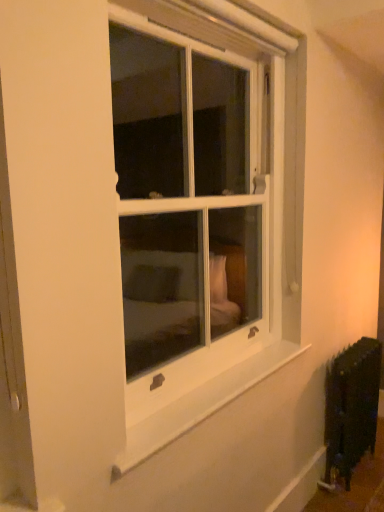
Where is `vacant area on top of white smooth window sill at lower center (from a real-world perspective)`? vacant area on top of white smooth window sill at lower center (from a real-world perspective) is located at coordinates (213, 381).